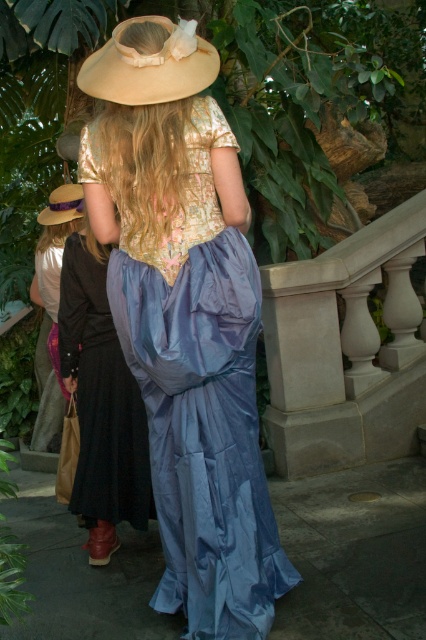
Does shiny blue fabric dress at center have a smaller size compared to beige fabric hat at upper center?

Actually, shiny blue fabric dress at center might be larger than beige fabric hat at upper center.

Can you confirm if shiny blue fabric dress at center is positioned above beige fabric hat at upper center?

Actually, shiny blue fabric dress at center is below beige fabric hat at upper center.

The height and width of the screenshot is (640, 426). Find the location of `shiny blue fabric dress at center`. shiny blue fabric dress at center is located at coordinates (201, 397).

You are a GUI agent. You are given a task and a screenshot of the screen. Output one action in this format:
    pyautogui.click(x=<x>, y=<y>)
    Task: Click on the shiny blue fabric dress at center
    The image size is (426, 640).
    Given the screenshot: What is the action you would take?
    pyautogui.click(x=201, y=397)

Does shiny blue fabric dress at center have a greater width compared to brown straw cowboy hat at upper left?

Indeed, shiny blue fabric dress at center has a greater width compared to brown straw cowboy hat at upper left.

Is shiny blue fabric dress at center to the right of brown straw cowboy hat at upper left from the viewer's perspective?

Indeed, shiny blue fabric dress at center is positioned on the right side of brown straw cowboy hat at upper left.

Is point (215, 593) positioned after point (80, 188)?

No, (215, 593) is in front of (80, 188).

I want to click on shiny blue fabric dress at center, so click(201, 397).

Can you confirm if matte blue dress at center is bigger than beige fabric hat at upper center?

Yes.

From the picture: Does matte blue dress at center lie behind beige fabric hat at upper center?

Yes, it is.

Where is `matte blue dress at center`? This screenshot has width=426, height=640. matte blue dress at center is located at coordinates (100, 403).